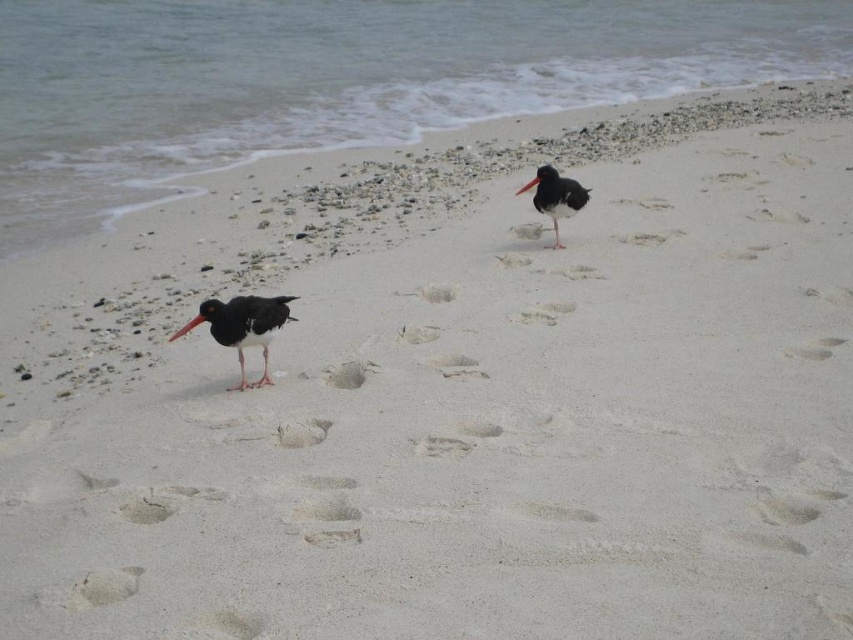
Question: Which of the following is the closest to the observer?

Choices:
 (A) (189, 326)
 (B) (531, 188)

Answer: (A)

Question: Does matte black beak at lower left lie behind black matte beak at upper right?

Choices:
 (A) no
 (B) yes

Answer: (A)

Question: Is black glossy bird at center to the left of black matte beak at upper right from the viewer's perspective?

Choices:
 (A) no
 (B) yes

Answer: (A)

Question: Which point is closer to the camera?

Choices:
 (A) (549, 216)
 (B) (202, 316)
 (C) (233, 340)
 (D) (526, 188)

Answer: (B)

Question: Can you confirm if black glossy bird at center is bigger than matte black beak at lower left?

Choices:
 (A) no
 (B) yes

Answer: (B)

Question: Which object is the farthest from the matte black beak at lower left?

Choices:
 (A) black matte beak at upper right
 (B) black glossy oystercatcher at center

Answer: (A)